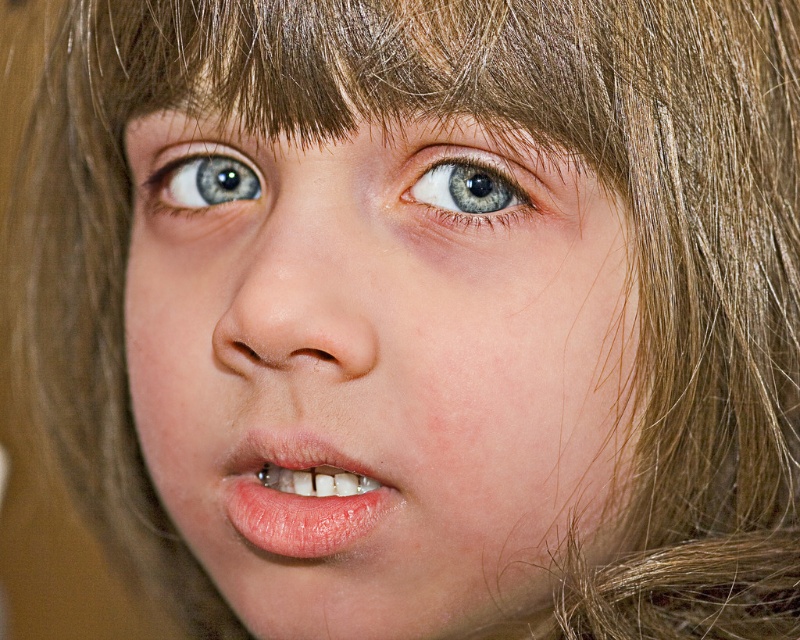
You are a dentist examining a patient. You need to place a dental tool between the pink glossy lips at center and the blue glossy eye at center. The tool is 4 inches long. Can you fit the tool between them?

The distance between the pink glossy lips at center and the blue glossy eye at center is 4.13 inches, so the 4 inch tool can fit between them since it is shorter than the available space.

You are a photographer adjusting the focus on a camera. You notice the smooth skin face at center and the blue glossy eye at upper left in your viewfinder. Which object should you focus on to ensure the subject is sharp and clear?

The smooth skin face at center should be focused on because it is in front of the blue glossy eye at upper left, making it the primary subject closer to the camera.

You are a dentist examining a patient. You notice a point at coordinates point [302,493] on their face. Based on the image description, where is this point located?

The point [302,493] is located on the pink glossy lips at center.